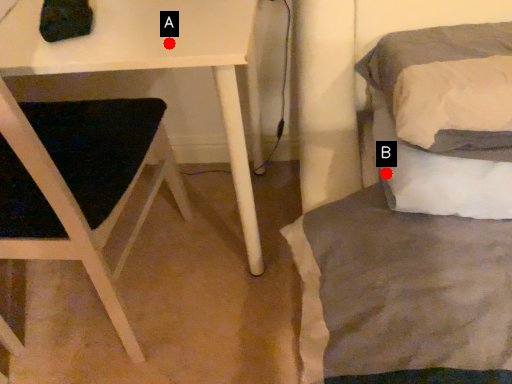
Question: Two points are circled on the image, labeled by A and B beside each circle. Which point appears closest to the camera in this image?

Choices:
 (A) A is closer
 (B) B is closer

Answer: (A)